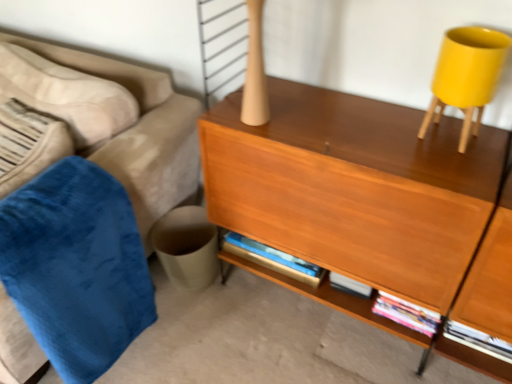
Describe the element at coordinates (111, 119) in the screenshot. The height and width of the screenshot is (384, 512). I see `velvet blue couch at left` at that location.

This screenshot has width=512, height=384. What do you see at coordinates (355, 187) in the screenshot?
I see `wooden desk at center` at bounding box center [355, 187].

What is the approximate height of velvet blue blanket at left?

It is 27.47 inches.

Identify the location of matte yellow plastic swivel chair at upper right. 466,76.

At what (x,y) coordinates should I click in order to perform the action: click on swivel chair that appears above the velvet blue couch at left (from the image's perspective). Please return your answer as a coordinate pair (x, y). This screenshot has width=512, height=384. Looking at the image, I should click on (466, 76).

In the scene shown: From a real-world perspective, which object stands above the other?

In real-world perspective, matte yellow plastic swivel chair at upper right is above.

From the image's perspective, which is below, matte yellow plastic swivel chair at upper right or velvet blue couch at left?

velvet blue couch at left appears lower in the image.

From the image's perspective, which is above, velvet blue couch at left or wooden desk at center?

From the image's view, velvet blue couch at left is above.

Which of these two, velvet blue couch at left or wooden desk at center, stands shorter?

With less height is velvet blue couch at left.

Find the location of a particular element. The height and width of the screenshot is (384, 512). studio couch above the wooden desk at center (from the image's perspective) is located at coordinates 111,119.

Is wooden desk at center oriented towards velvet blue couch at left?

No, wooden desk at center is not turned towards velvet blue couch at left.

Is wooden desk at center thinner than velvet blue couch at left?

Yes.

Relative to velvet blue couch at left, is wooden desk at center in front or behind?

In the image, wooden desk at center appears in front of velvet blue couch at left.

From a real-world perspective, is wooden desk at center below velvet blue couch at left?

No, from a real-world perspective, wooden desk at center is not below velvet blue couch at left.

Does velvet blue blanket at left turn towards velvet blue couch at left?

Yes, velvet blue blanket at left is facing velvet blue couch at left.

Looking at this image, between velvet blue blanket at left and velvet blue couch at left, which one has less height?

velvet blue blanket at left.

Between velvet blue blanket at left and velvet blue couch at left, which one is positioned behind?

velvet blue blanket at left is further away from the camera.

Can you confirm if matte yellow plastic swivel chair at upper right is shorter than wooden desk at center?

Indeed, matte yellow plastic swivel chair at upper right has a lesser height compared to wooden desk at center.

Is wooden desk at center located within matte yellow plastic swivel chair at upper right?

No, matte yellow plastic swivel chair at upper right does not contain wooden desk at center.

There is a wooden desk at center. Where is `swivel chair above it (from a real-world perspective)`? swivel chair above it (from a real-world perspective) is located at coordinates (466, 76).

From a real-world perspective, is matte yellow plastic swivel chair at upper right above or below wooden desk at center?

matte yellow plastic swivel chair at upper right is above wooden desk at center.

From the picture: Could you tell me if velvet blue blanket at left is turned towards matte yellow plastic swivel chair at upper right?

No, velvet blue blanket at left is not turned towards matte yellow plastic swivel chair at upper right.

Is velvet blue blanket at left positioned behind matte yellow plastic swivel chair at upper right?

No, velvet blue blanket at left is closer to the viewer.

Are velvet blue blanket at left and matte yellow plastic swivel chair at upper right beside each other?

No, velvet blue blanket at left is not touching matte yellow plastic swivel chair at upper right.

From the image's perspective, does velvet blue blanket at left appear higher than matte yellow plastic swivel chair at upper right?

No, from the image's perspective, velvet blue blanket at left is not above matte yellow plastic swivel chair at upper right.

From a real-world perspective, is wooden desk at center physically located above or below velvet blue blanket at left?

In terms of real-world spatial position, wooden desk at center is above velvet blue blanket at left.

Locate an element on the screen. The image size is (512, 384). desk on the right of velvet blue blanket at left is located at coordinates (355, 187).

Is wooden desk at center closer to the viewer compared to velvet blue blanket at left?

Yes, wooden desk at center is in front of velvet blue blanket at left.

Between point (311, 106) and point (104, 288), which one is positioned behind?

Positioned behind is point (311, 106).

At what (x,y) coordinates should I click in order to perform the action: click on swivel chair located on the right of velvet blue couch at left. Please return your answer as a coordinate pair (x, y). The width and height of the screenshot is (512, 384). Looking at the image, I should click on (466, 76).

Locate an element on the screen. The height and width of the screenshot is (384, 512). studio couch lying behind the wooden desk at center is located at coordinates (111, 119).

Estimate the real-world distances between objects in this image. Which object is further from velvet blue blanket at left, velvet blue couch at left or matte yellow plastic swivel chair at upper right?

Based on the image, matte yellow plastic swivel chair at upper right appears to be further to velvet blue blanket at left.

Which object lies nearer to the anchor point matte yellow plastic swivel chair at upper right, velvet blue blanket at left or wooden desk at center?

Based on the image, wooden desk at center appears to be nearer to matte yellow plastic swivel chair at upper right.

Considering their positions, is matte yellow plastic swivel chair at upper right positioned closer to velvet blue blanket at left than wooden desk at center?

A: wooden desk at center is positioned closer to the anchor velvet blue blanket at left.

Based on their spatial positions, is wooden desk at center or velvet blue couch at left closer to velvet blue blanket at left?

The object closer to velvet blue blanket at left is velvet blue couch at left.

Looking at the image, which one is located closer to velvet blue blanket at left, velvet blue couch at left or wooden desk at center?

The object closer to velvet blue blanket at left is velvet blue couch at left.

When comparing their distances from wooden desk at center, does matte yellow plastic swivel chair at upper right or velvet blue blanket at left seem closer?

matte yellow plastic swivel chair at upper right is positioned closer to the anchor wooden desk at center.

Looking at the image, which one is located closer to wooden desk at center, velvet blue couch at left or velvet blue blanket at left?

velvet blue blanket at left.

In the scene shown: Based on their spatial positions, is matte yellow plastic swivel chair at upper right or velvet blue blanket at left closer to velvet blue couch at left?

velvet blue blanket at left lies closer to velvet blue couch at left than the other object.

The image size is (512, 384). Identify the location of blanket between velvet blue couch at left and wooden desk at center from left to right. (76, 267).

Find the location of a particular element. The width and height of the screenshot is (512, 384). blanket between velvet blue couch at left and matte yellow plastic swivel chair at upper right in the horizontal direction is located at coordinates (76, 267).

Locate an element on the screen. desk between velvet blue blanket at left and matte yellow plastic swivel chair at upper right from left to right is located at coordinates (355, 187).

Locate an element on the screen. The image size is (512, 384). desk located between velvet blue couch at left and matte yellow plastic swivel chair at upper right in the left-right direction is located at coordinates (355, 187).